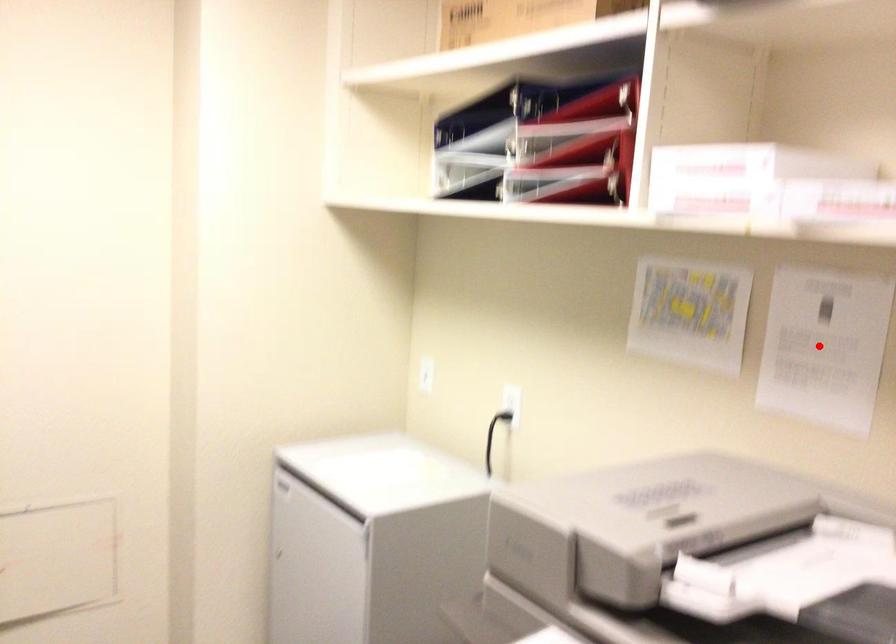
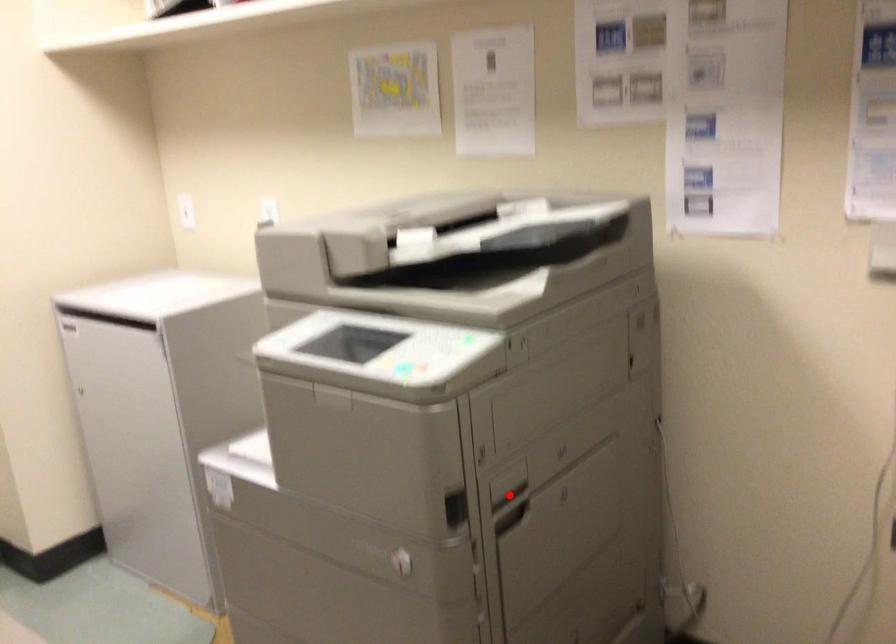
I am providing you with two images of the same scene from different viewpoints. A red point is marked on the first image and another point is marked on the second image. Are the points marked in image1 and image2 representing the same 3D position?

No